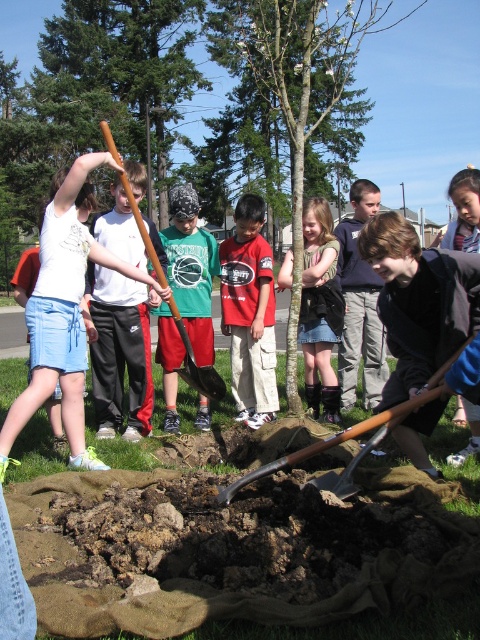
Question: Does red cotton shirt at center appear on the left side of denim skirt at center?

Choices:
 (A) yes
 (B) no

Answer: (A)

Question: Among these objects, which one is farthest from the camera?

Choices:
 (A) wooden shovel at lower center
 (B) red cotton shirt at center
 (C) green jersey at center
 (D) white cotton shirt at upper left

Answer: (B)

Question: Can you confirm if red cotton shirt at center is bigger than green jersey at center?

Choices:
 (A) no
 (B) yes

Answer: (A)

Question: Does red cotton shirt at center have a larger size compared to green jersey at center?

Choices:
 (A) yes
 (B) no

Answer: (B)

Question: Which object is farther from the camera taking this photo?

Choices:
 (A) denim skirt at center
 (B) wooden shovel at lower center
 (C) red cotton shirt at center
 (D) matte black shirt at center

Answer: (D)

Question: Among these objects, which one is farthest from the camera?

Choices:
 (A) denim skirt at center
 (B) green jersey at center
 (C) matte black shirt at center

Answer: (C)